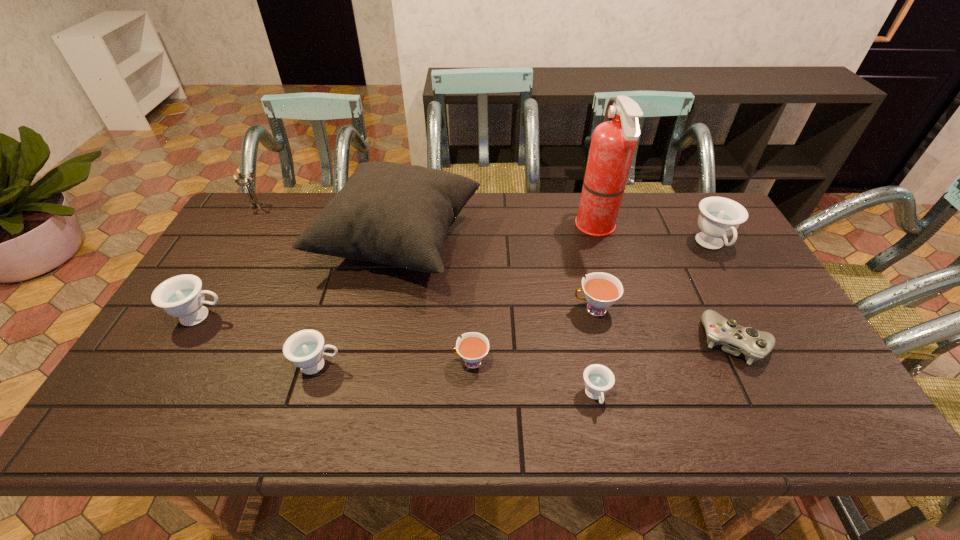
Where is `the bigger white teacup`? This screenshot has width=960, height=540. the bigger white teacup is located at coordinates (601, 290).

Where is `the third biggest blue teacup`? the third biggest blue teacup is located at coordinates (304, 348).

The image size is (960, 540). Identify the location of the fifth teacup from right to left. 304,348.

Where is `control`? control is located at coordinates (755, 345).

In order to click on the fourth teacup from right to left in this screenshot , I will do `click(473, 346)`.

Where is `the left white teacup`? This screenshot has width=960, height=540. the left white teacup is located at coordinates click(x=473, y=346).

Find the location of `the third blue teacup from left to right`. the third blue teacup from left to right is located at coordinates (598, 378).

Where is `free point located 0.340m with the handle and hose on the red fire extinguisher`? The width and height of the screenshot is (960, 540). free point located 0.340m with the handle and hose on the red fire extinguisher is located at coordinates (472, 228).

Identify the location of vacant space located with the handle and hose on the red fire extinguisher. (475, 228).

In order to click on free space located with the handle and hose on the red fire extinguisher in this screenshot , I will do `click(555, 228)`.